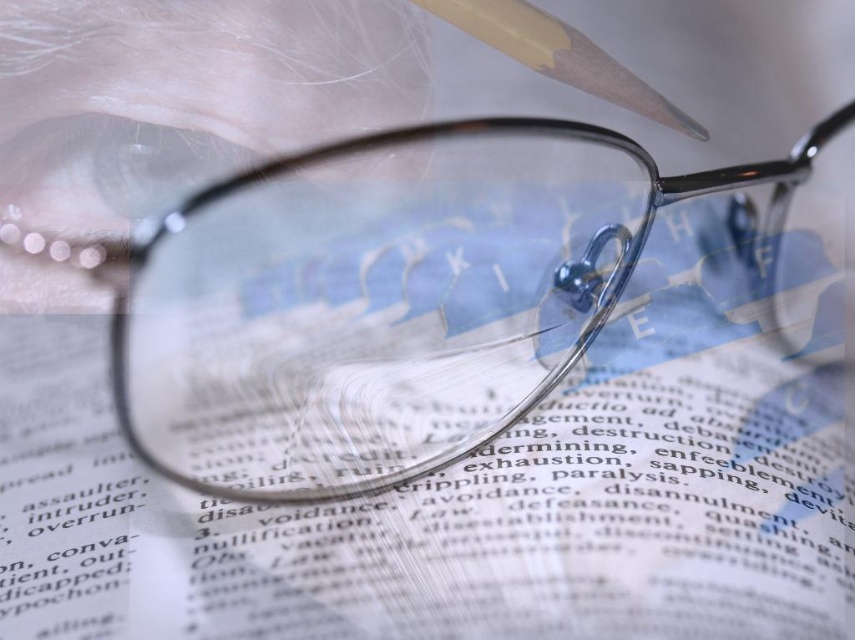
Question: Is transparent plastic book at center wider than matte black glasses at center?

Choices:
 (A) yes
 (B) no

Answer: (A)

Question: Where is matte black glasses at center located in relation to matte wood pencil at upper center in the image?

Choices:
 (A) left
 (B) right

Answer: (A)

Question: Which of these objects is positioned farthest from the matte black glasses at center?

Choices:
 (A) transparent plastic book at center
 (B) matte wood pencil at upper center

Answer: (B)

Question: Which object appears closest to the camera in this image?

Choices:
 (A) matte black glasses at center
 (B) transparent plastic book at center
 (C) matte wood pencil at upper center

Answer: (A)

Question: Which point is farther from the camera taking this photo?

Choices:
 (A) (301, 204)
 (B) (160, 556)

Answer: (A)

Question: Is transparent plastic book at center positioned at the back of matte wood pencil at upper center?

Choices:
 (A) yes
 (B) no

Answer: (B)